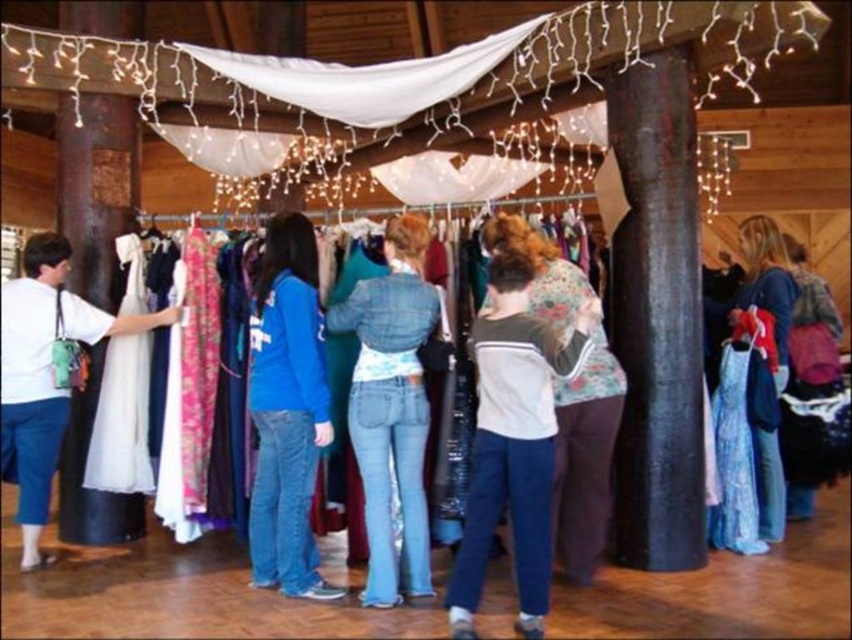
You are organizing a clothing event and need to move the gray cotton sweatshirt at center and the white matte dress at left. Which item should you move first if you want to access the one behind them?

You should move the gray cotton sweatshirt at center first because it is in front of the white matte dress at left, allowing access to the dress behind it.

You are standing in the rustic wooden venue and want to take a photo of both the point at coordinates (393,397) and the point at coordinates (258,524). Which point should you focus on first to ensure both are in clear view?

You should focus on point (393,397) first because it is closer to the camera than point (258,524). This ensures that both points will be in focus when taking the photo.